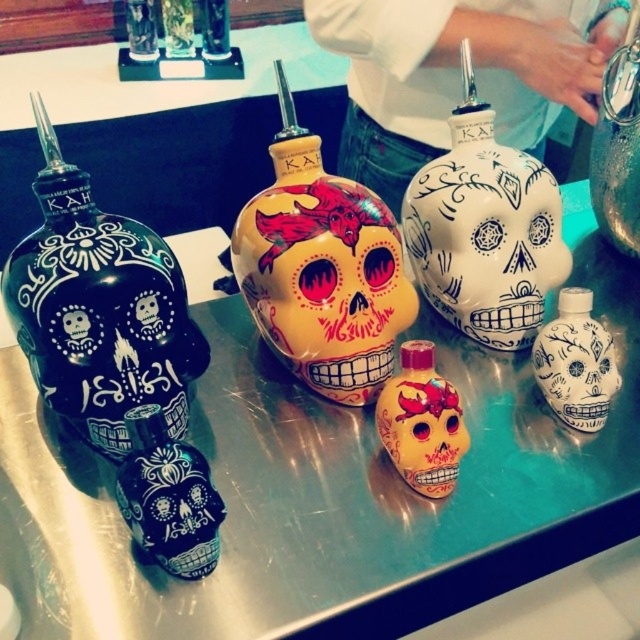
Question: Which is nearer to the white glossy skull at lower right?

Choices:
 (A) matte black skull at left
 (B) blue glossy skull at lower left

Answer: (B)

Question: Is blue glossy skull at lower left in front of matte red skull at center?

Choices:
 (A) no
 (B) yes

Answer: (B)

Question: Which point appears farthest from the camera in this image?

Choices:
 (A) (528, 289)
 (B) (387, 340)
 (C) (128, 419)
 (D) (67, 340)

Answer: (A)

Question: Considering the relative positions of matte black skull at left and matte red skull at center in the image provided, where is matte black skull at left located with respect to matte red skull at center?

Choices:
 (A) right
 (B) left

Answer: (B)

Question: Can you confirm if metallic silver tray at center is positioned to the right of blue glossy skull at lower left?

Choices:
 (A) no
 (B) yes

Answer: (B)

Question: Which point is farther from the camera taking this photo?

Choices:
 (A) tap(230, 250)
 (B) tap(16, 253)

Answer: (A)